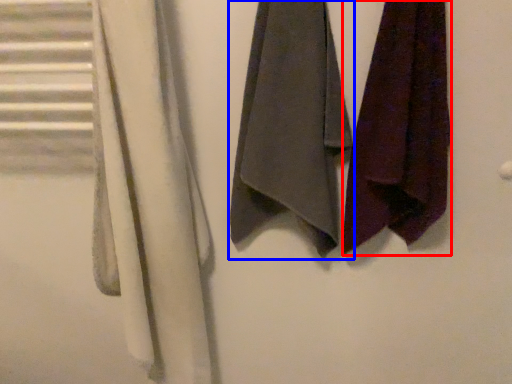
Question: Which object is closer to the camera taking this photo, towel (highlighted by a red box) or towel (highlighted by a blue box)?

Choices:
 (A) towel
 (B) towel

Answer: (A)